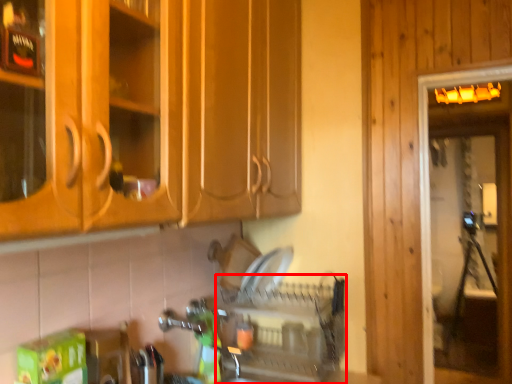
Question: From the image's perspective, what is the correct spatial positioning of dish washer (annotated by the red box) in reference to screen door?

Choices:
 (A) above
 (B) below

Answer: (B)